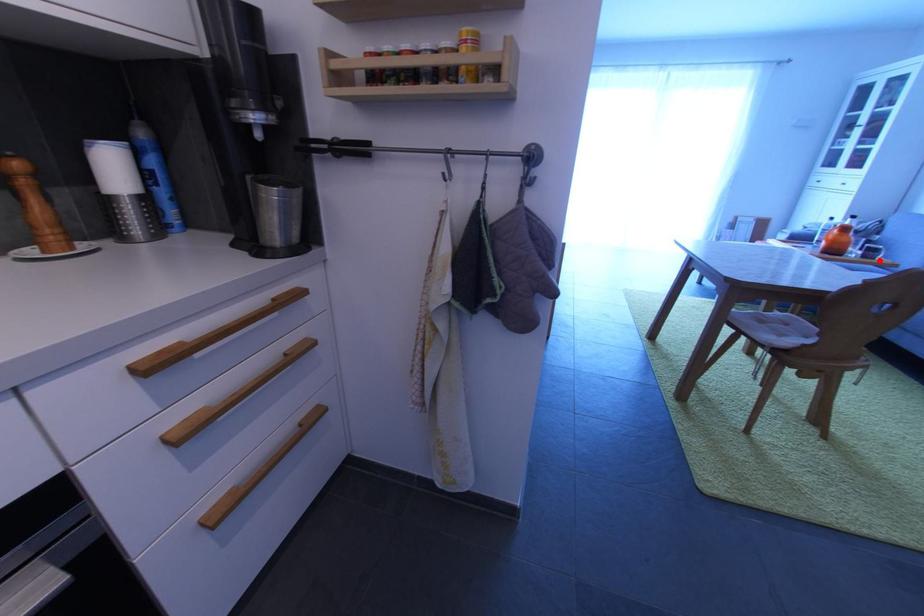
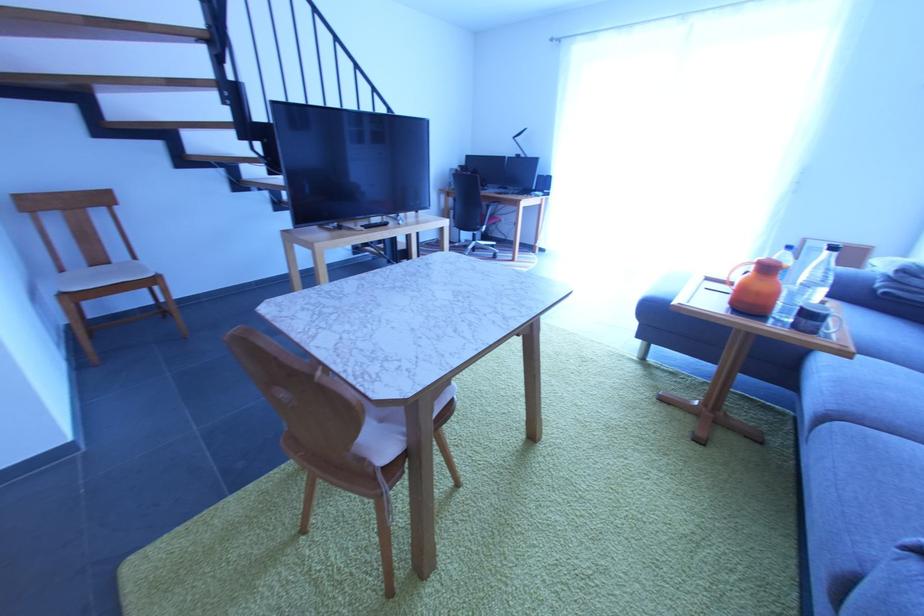
Question: I am providing you with two images of the same scene from different viewpoints. Given a red point in image1, look at the same physical point in image2. Is it:

Choices:
 (A) Closer to the viewpoint
 (B) Farther from the viewpoint

Answer: (A)